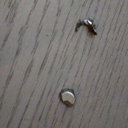
The height and width of the screenshot is (128, 128). I want to click on grain of wood, so click(x=30, y=98), click(x=42, y=67), click(x=29, y=69), click(x=10, y=76).